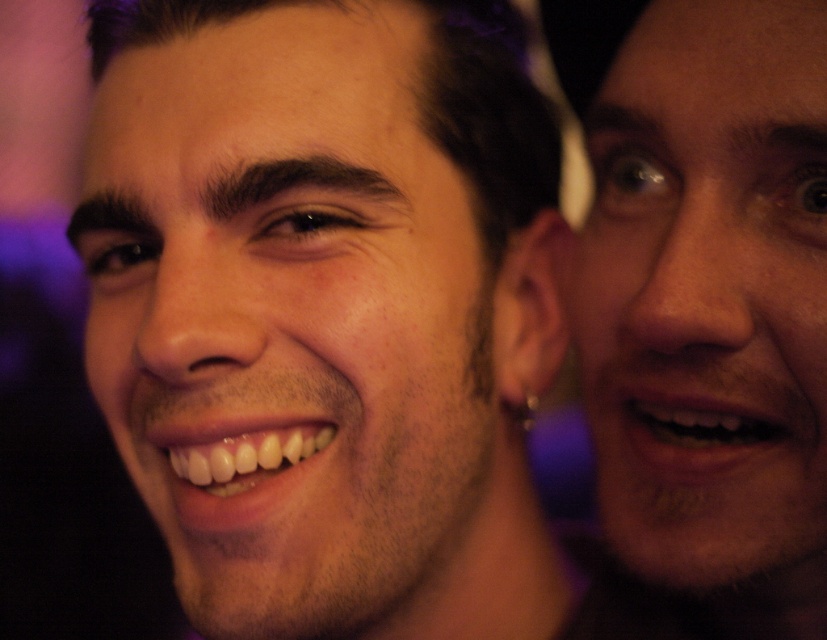
Image resolution: width=827 pixels, height=640 pixels. Describe the element at coordinates (288, 320) in the screenshot. I see `smooth skin face at center` at that location.

Where is `smooth skin face at center`? smooth skin face at center is located at coordinates (288, 320).